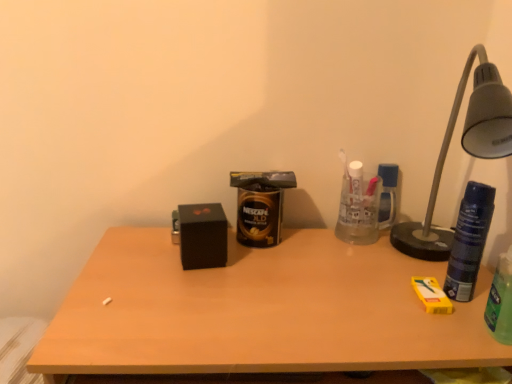
Locate an element on the screen. The height and width of the screenshot is (384, 512). empty space that is ontop of wooden desk at center (from a real-world perspective) is located at coordinates (313, 279).